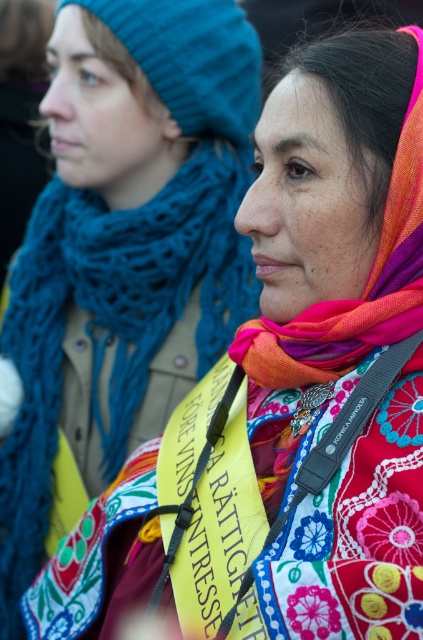
You are a photographer trying to capture both the multicolored woven scarf at center and the knitted blue scarf at left in a single frame. Based on their positions, which scarf will appear closer to the camera in the photo?

The multicolored woven scarf at center will appear closer to the camera because it is in front of the knitted blue scarf at left.

You are organizing a fashion show and need to display two scarves on a mannequin. The mannequin has a neck that can only accommodate scarves with a width of at least 30 cm. Given the information provided, can both the multicolored woven scarf at center and the knitted blue scarf at left fit on the mannequin?

The multicolored woven scarf at center has a width less than the knitted blue scarf at left. Since the mannequin requires scarves of at least 30 cm, we need to know the exact widths. However, the description only states the comparative width between them. Without specific measurements, it is impossible to determine if either meets the 30 cm requirement. Therefore, additional information is needed to confirm if both scarves can fit on the mannequin.

You are a photographer at the event and want to capture the multicolored woven scarf at center in your shot. Where should you position your camera to ensure it is centered in the frame?

Position the camera so that the multicolored woven scarf at center is at the coordinates point (343, 224) to ensure it is centered in the frame.